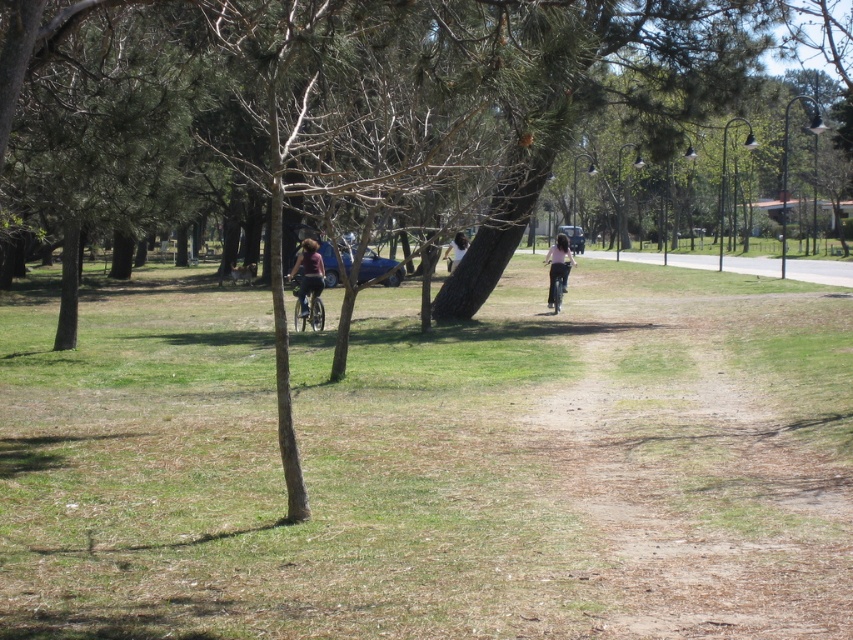
Between point (769, 596) and point (556, 240), which one is positioned in front?

Point (769, 596)

Can you confirm if green grass at center is thinner than pink fabric pants at center?

No.

The image size is (853, 640). In order to click on green grass at center in this screenshot , I will do `click(431, 461)`.

This screenshot has width=853, height=640. Identify the location of green grass at center. (431, 461).

Between matte purple shirt at center and shiny metallic bicycle at center-left, which one has more height?

matte purple shirt at center

Can you confirm if matte purple shirt at center is smaller than shiny metallic bicycle at center-left?

Yes.

Is point (320, 291) closer to viewer compared to point (311, 307)?

Yes, it is.

At what (x,y) coordinates should I click in order to perform the action: click on matte purple shirt at center. Please return your answer as a coordinate pair (x, y). Looking at the image, I should click on (308, 273).

Is shiny metallic bicycle at center-left above white shirt at center?

No, shiny metallic bicycle at center-left is not above white shirt at center.

The width and height of the screenshot is (853, 640). Describe the element at coordinates (311, 312) in the screenshot. I see `shiny metallic bicycle at center-left` at that location.

Where is `shiny metallic bicycle at center-left`? Image resolution: width=853 pixels, height=640 pixels. shiny metallic bicycle at center-left is located at coordinates (311, 312).